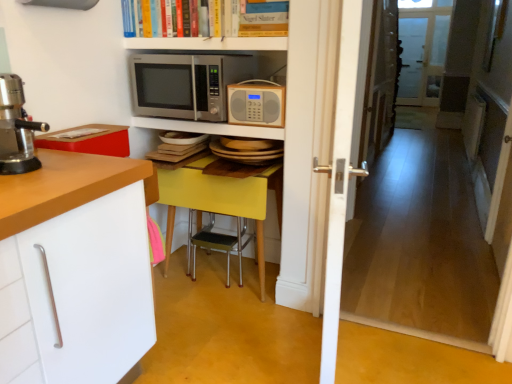
Question: Is the position of metallic silver microwave at upper center, marked as the second shelf in a top-to-bottom arrangement, more distant than that of yellow matte table at center?

Choices:
 (A) yes
 (B) no

Answer: (B)

Question: Considering the relative positions of metallic silver microwave at upper center, marked as the second shelf in a top-to-bottom arrangement, and yellow matte table at center in the image provided, is metallic silver microwave at upper center, marked as the second shelf in a top-to-bottom arrangement, to the left of yellow matte table at center from the viewer's perspective?

Choices:
 (A) yes
 (B) no

Answer: (A)

Question: From the image's perspective, is metallic silver microwave at upper center, the 1th shelf from the bottom, on yellow matte table at center?

Choices:
 (A) no
 (B) yes

Answer: (B)

Question: Could yellow matte table at center be considered to be inside metallic silver microwave at upper center, marked as the second shelf in a top-to-bottom arrangement?

Choices:
 (A) yes
 (B) no

Answer: (B)

Question: Would you say metallic silver microwave at upper center, marked as the second shelf in a top-to-bottom arrangement, is outside yellow matte table at center?

Choices:
 (A) yes
 (B) no

Answer: (A)

Question: In terms of height, does yellow matte table at center look taller or shorter compared to wooden radio at center, placed as the 1th microwave oven when sorted from right to left?

Choices:
 (A) tall
 (B) short

Answer: (A)

Question: Does point (278, 195) appear closer or farther from the camera than point (234, 117)?

Choices:
 (A) closer
 (B) farther

Answer: (B)

Question: From the image's perspective, is yellow matte table at center positioned above or below wooden radio at center, arranged as the 2th microwave oven when viewed from the left?

Choices:
 (A) below
 (B) above

Answer: (A)

Question: Visually, is yellow matte table at center positioned to the left or to the right of wooden radio at center, placed as the 1th microwave oven when sorted from right to left?

Choices:
 (A) right
 (B) left

Answer: (B)

Question: From the image's perspective, relative to satin silver microwave at upper center, positioned as the second microwave oven in right-to-left order, is transparent glass screen door at upper right above or below?

Choices:
 (A) above
 (B) below

Answer: (A)

Question: Considering the positions of transparent glass screen door at upper right and satin silver microwave at upper center, the first microwave oven when ordered from left to right, in the image, is transparent glass screen door at upper right wider or thinner than satin silver microwave at upper center, the first microwave oven when ordered from left to right,?

Choices:
 (A) wide
 (B) thin

Answer: (B)

Question: From their relative heights in the image, would you say transparent glass screen door at upper right is taller or shorter than satin silver microwave at upper center, positioned as the second microwave oven in right-to-left order?

Choices:
 (A) tall
 (B) short

Answer: (A)

Question: Do you think transparent glass screen door at upper right is within satin silver microwave at upper center, the first microwave oven when ordered from left to right, or outside of it?

Choices:
 (A) inside
 (B) outside

Answer: (B)

Question: Considering the positions of yellow matte table at center and wooden floor at center in the image, is yellow matte table at center wider or thinner than wooden floor at center?

Choices:
 (A) thin
 (B) wide

Answer: (B)

Question: In terms of height, does yellow matte table at center look taller or shorter compared to wooden floor at center?

Choices:
 (A) tall
 (B) short

Answer: (B)